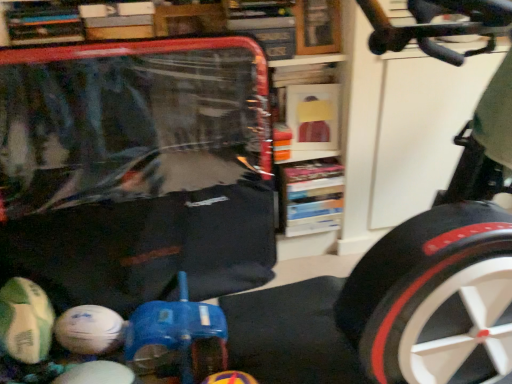
In order to face white matte soccer ball at lower left, should I rotate leftwards or rightwards?

You should look left and rotate roughly 21.182 degrees.

What is the approximate height of white matte soccer ball at lower left?

It is 14.69 centimeters.

What do you see at coordinates (89, 330) in the screenshot? I see `white matte soccer ball at lower left` at bounding box center [89, 330].

Measure the distance between point (x=81, y=351) and camera.

Point (x=81, y=351) and camera are 4.38 feet apart.

You are a GUI agent. You are given a task and a screenshot of the screen. Output one action in this format:
    pyautogui.click(x=<x>, y=<y>)
    Task: Click on the white matte soccer ball at lower left
    
    Given the screenshot: What is the action you would take?
    pyautogui.click(x=89, y=330)

Where is `white matte soccer ball at lower left`? Image resolution: width=512 pixels, height=384 pixels. white matte soccer ball at lower left is located at coordinates (89, 330).